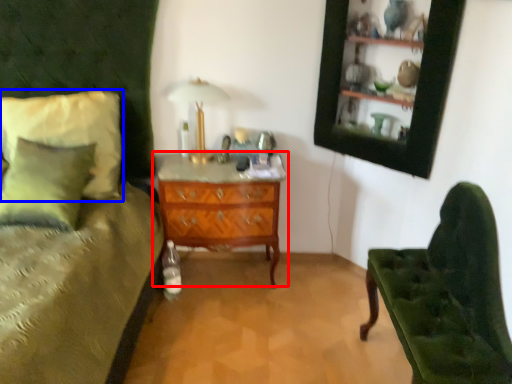
Question: Among these objects, which one is nearest to the camera, chest of drawers (highlighted by a red box) or pillow (highlighted by a blue box)?

Choices:
 (A) chest of drawers
 (B) pillow

Answer: (B)